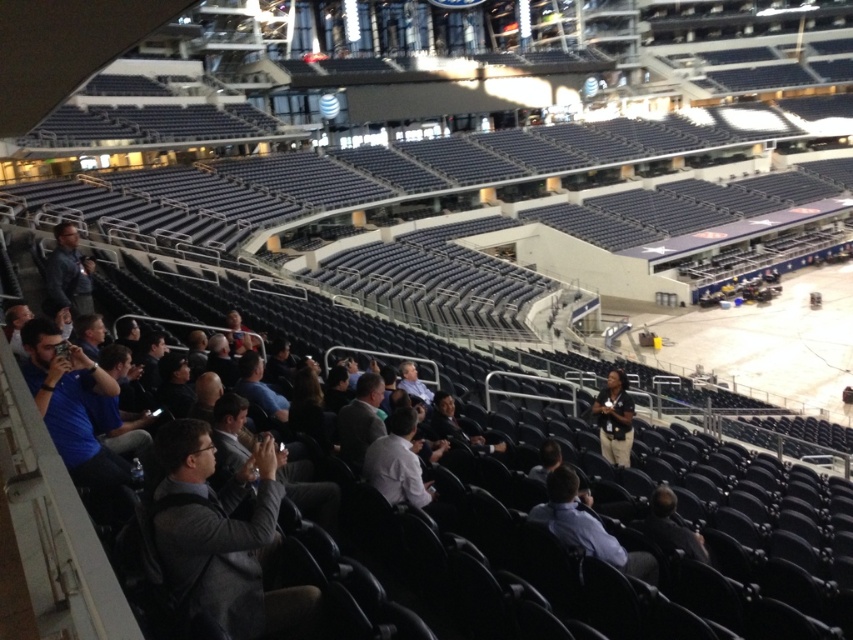
Is dark gray shirt at center above dark gray suit at center?

Indeed, dark gray shirt at center is positioned over dark gray suit at center.

Which is above, dark gray shirt at center or dark gray suit at center?

Positioned higher is dark gray shirt at center.

Is point (624, 404) more distant than point (662, 486)?

Yes, point (624, 404) is behind point (662, 486).

Locate an element on the screen. dark gray shirt at center is located at coordinates (614, 419).

Describe the element at coordinates (585, 525) in the screenshot. I see `light blue shirt at center` at that location.

Is light blue shirt at center smaller than dark gray suit at center?

No, light blue shirt at center is not smaller than dark gray suit at center.

The height and width of the screenshot is (640, 853). I want to click on light blue shirt at center, so click(x=585, y=525).

Image resolution: width=853 pixels, height=640 pixels. Identify the location of light blue shirt at center. (585, 525).

Is dark gray jacket at left below dark gray shirt at center?

No, dark gray jacket at left is not below dark gray shirt at center.

Is dark gray jacket at left wider than dark gray shirt at center?

Indeed, dark gray jacket at left has a greater width compared to dark gray shirt at center.

Between point (49, 280) and point (606, 396), which one is positioned behind?

The point (49, 280) is more distant.

At what (x,y) coordinates should I click in order to perform the action: click on dark gray jacket at left. Please return your answer as a coordinate pair (x, y). The height and width of the screenshot is (640, 853). Looking at the image, I should click on (68, 272).